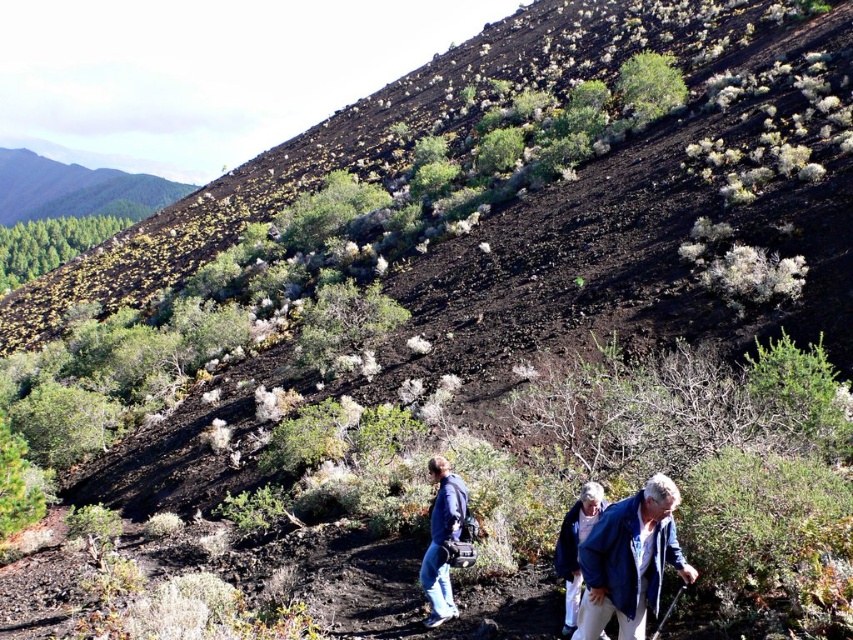
Question: Does blue fabric jacket at center appear over blue denim jacket at center?

Choices:
 (A) yes
 (B) no

Answer: (A)

Question: Which object appears closest to the camera in this image?

Choices:
 (A) blue denim jacket at lower right
 (B) blue denim jacket at center
 (C) blue fabric jacket at center

Answer: (A)

Question: Which object appears farthest from the camera in this image?

Choices:
 (A) blue denim jacket at lower right
 (B) blue denim jacket at center
 (C) blue fabric jacket at center

Answer: (B)

Question: Which of the following is the closest to the observer?

Choices:
 (A) (444, 460)
 (B) (631, 497)
 (C) (607, 582)

Answer: (C)

Question: Is blue denim jacket at lower right to the right of blue denim jacket at center from the viewer's perspective?

Choices:
 (A) no
 (B) yes

Answer: (B)

Question: Does blue denim jacket at lower right appear on the right side of blue denim jacket at center?

Choices:
 (A) yes
 (B) no

Answer: (A)